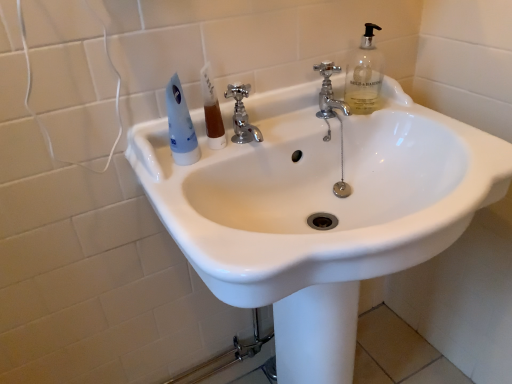
Question: Considering their positions, is brown translucent liquid at center located in front of or behind white glossy sink at center?

Choices:
 (A) front
 (B) behind

Answer: (B)

Question: Based on their positions, is brown translucent liquid at center located to the left or right of white glossy sink at center?

Choices:
 (A) left
 (B) right

Answer: (A)

Question: Which object is the closest to the blue plastic toothpaste at upper left?

Choices:
 (A) brown translucent liquid at center
 (B) white glossy sink at center
 (C) polished chrome faucet at upper center, positioned as the 1th tap in right-to-left order
 (D) chrome metallic faucet at center, positioned as the second tap in right-to-left order

Answer: (A)

Question: Which object is the farthest from the polished chrome faucet at upper center, positioned as the 1th tap in right-to-left order?

Choices:
 (A) chrome metallic faucet at center, positioned as the second tap in right-to-left order
 (B) brown translucent liquid at center
 (C) blue plastic toothpaste at upper left
 (D) white glossy sink at center

Answer: (C)